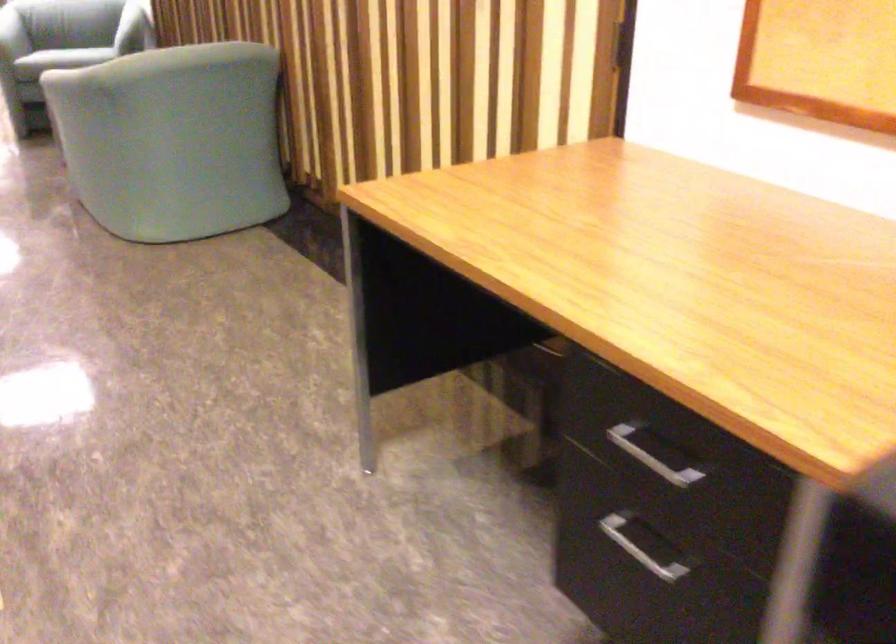
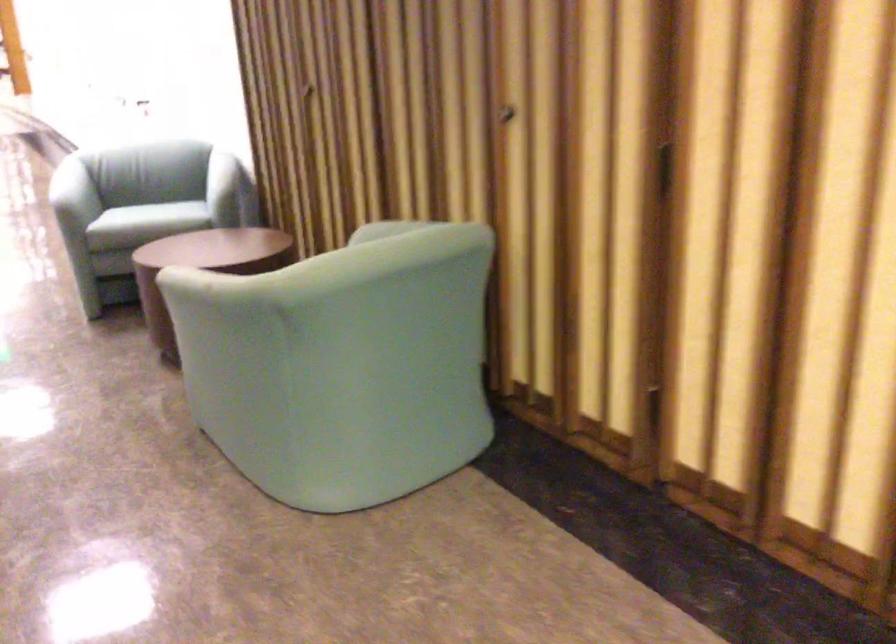
What movement of the cameraman would produce the second image?

The movement direction of the cameraman is left, forward.